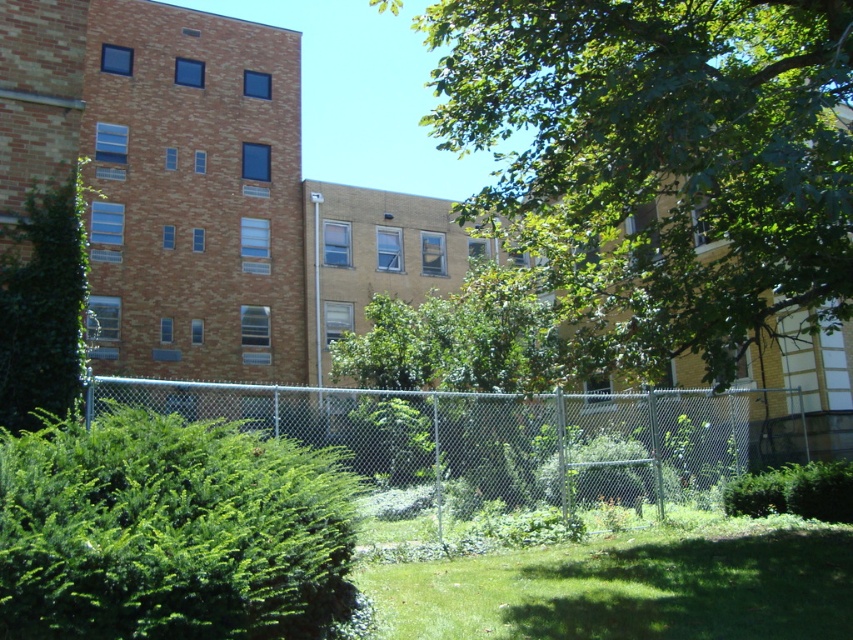
You are standing in the fenced area and want to walk from the point at coordinates point (556, 113) to the point at coordinates point (477, 429). Which direction should you face to move towards the second point?

Since point (556, 113) is closer to the viewer than point (477, 429), you should face away from the viewer to move towards the second point.

You are a gardener who needs to water both the green leafy bush at lower left and the green leafy hedge at lower right. Your watering can holds enough water to cover 10 meters. If you start at the bush, can you reach the hedge without refilling your can?

The distance between the green leafy bush at lower left and the green leafy hedge at lower right is 9.14 meters. Since your watering can can cover 10 meters, you can water both without needing to refill.